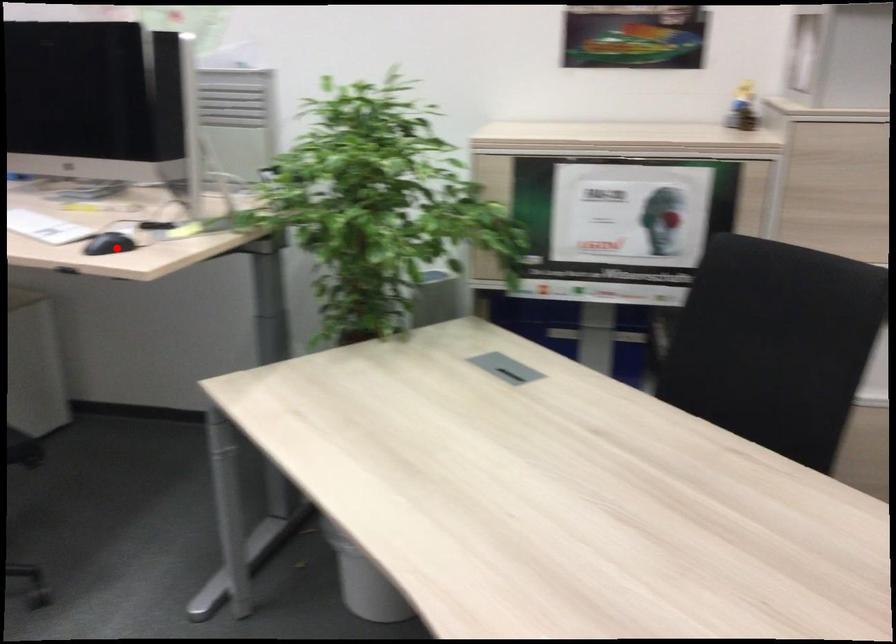
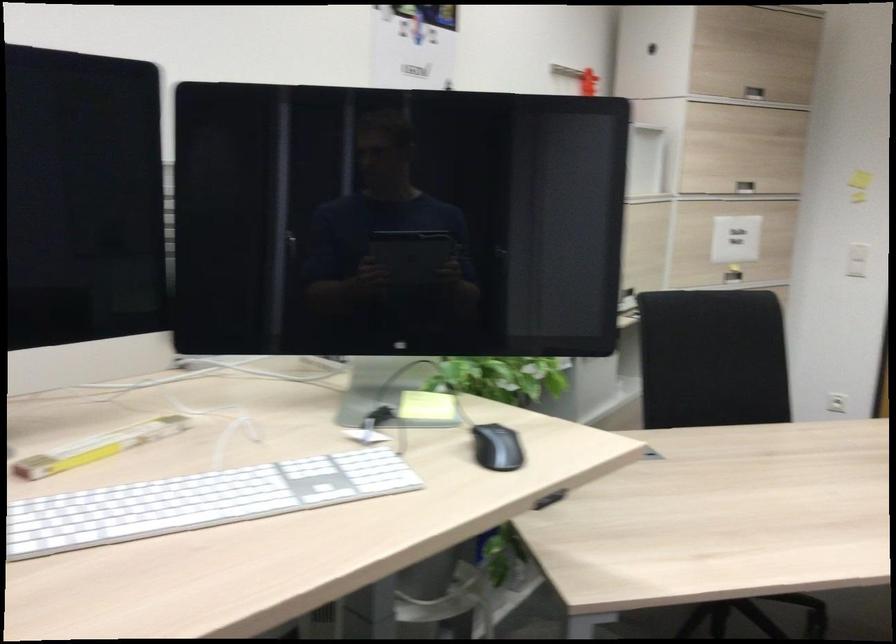
Question: I am providing you with two images of the same scene from different viewpoints. In image1, a red point is highlighted. Considering the same 3D point in image2, which of the following is correct?

Choices:
 (A) It is closer
 (B) It is farther

Answer: (A)